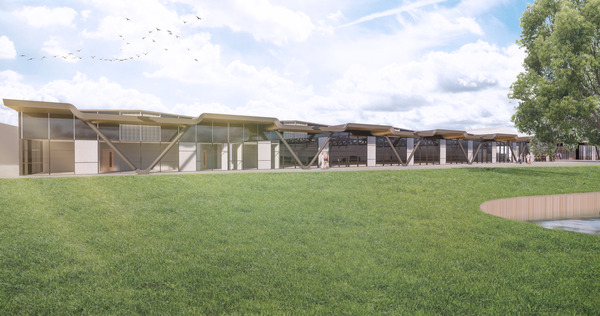
You are a GUI agent. You are given a task and a screenshot of the screen. Output one action in this format:
    pyautogui.click(x=<x>, y=<y>)
    Task: Click on the support beam
    This screenshot has width=600, height=316.
    Given the screenshot: What is the action you would take?
    pyautogui.click(x=117, y=154), pyautogui.click(x=158, y=158), pyautogui.click(x=293, y=155), pyautogui.click(x=311, y=157), pyautogui.click(x=398, y=152), pyautogui.click(x=409, y=154), pyautogui.click(x=463, y=151), pyautogui.click(x=475, y=153), pyautogui.click(x=512, y=153), pyautogui.click(x=520, y=152)